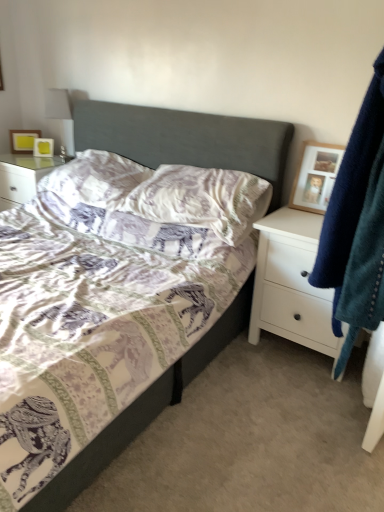
This screenshot has width=384, height=512. Find the location of `free spot in front of white matte chest of drawers at right`. free spot in front of white matte chest of drawers at right is located at coordinates (299, 397).